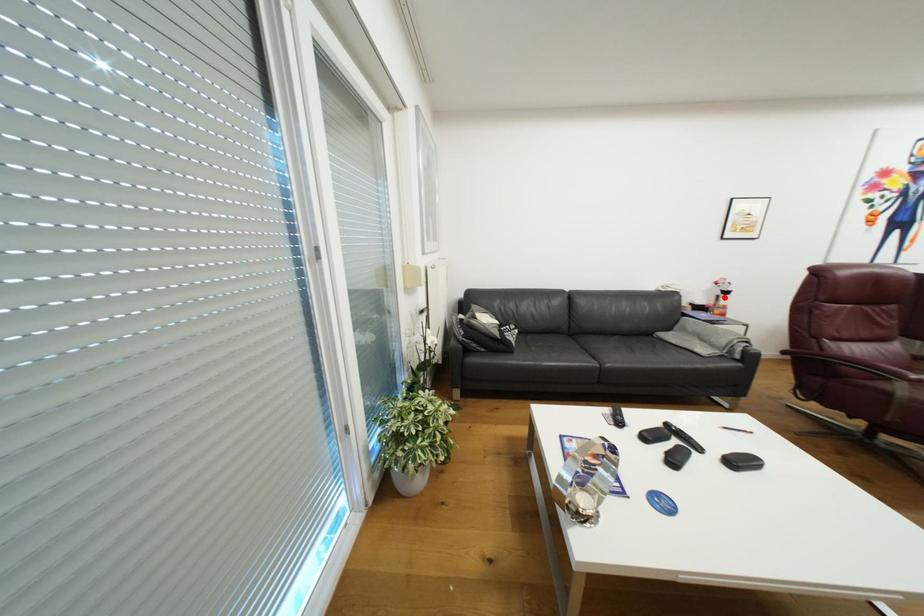
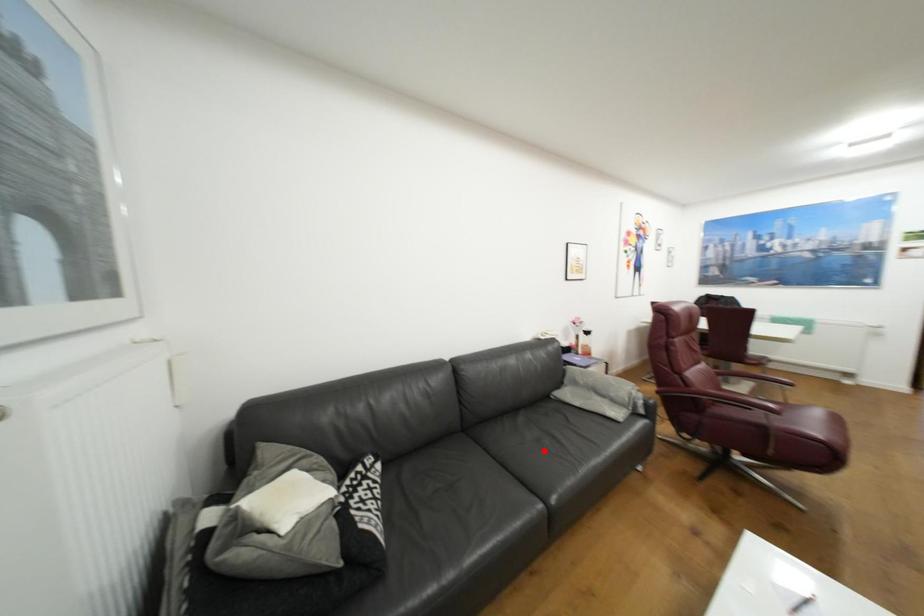
I am providing you with two images of the same scene from different viewpoints. A red point is marked on the first image and another point is marked on the second image. Is the marked point in image1 the same physical position as the marked point in image2?

No